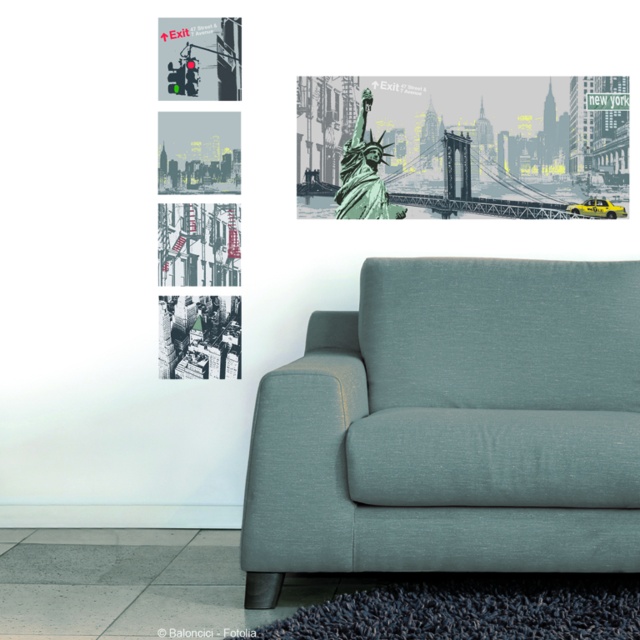
You are arranging a small table between the matte gray fabric couch at center and the green matte statue at upper center. The table is 1.2 meters wide. Can the table fit between them without overlapping either object?

The matte gray fabric couch at center is wider than the green matte statue at upper center. However, the description does not provide the exact distance between them, so we cannot determine if the table will fit. More information about the spacing between the two objects is needed to answer this question accurately.